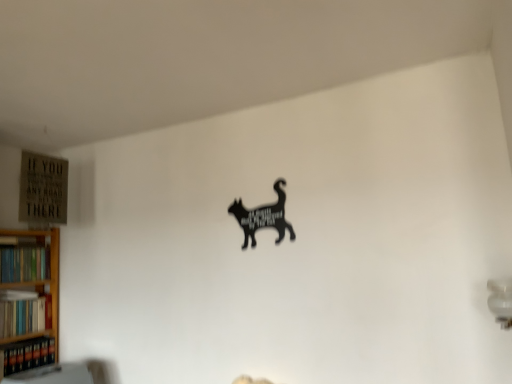
Find the location of a particular element. hardcover books at left, the 2th book when ordered from bottom to top is located at coordinates (24, 313).

In order to face black matte cat at center, should I rotate leftwards or rightwards?

A 0.563 degree turn to the right will do.

Find the location of a particular element. black matte cat at center is located at coordinates (263, 217).

The height and width of the screenshot is (384, 512). What are the coordinates of `hardcover books at left, the second book in the top-to-bottom sequence` in the screenshot? It's located at (24, 313).

Is hardcover books at left, positioned as the third book in bottom-to-top order, behind black matte cat at center?

Yes, hardcover books at left, positioned as the third book in bottom-to-top order, is further from the camera.

Can we say hardcover books at left, positioned as the third book in bottom-to-top order, lies outside black matte cat at center?

Yes.

From the image's perspective, count 1st books downward from the black matte cat at center and point to it. Please provide its 2D coordinates.

[(24, 263)]

From their relative heights in the image, would you say hardcover books at left, the 1th book positioned from the top, is taller or shorter than black matte cat at center?

hardcover books at left, the 1th book positioned from the top, is shorter than black matte cat at center.

Is point (236, 210) positioned in front of point (39, 250)?

Yes, it is in front of point (39, 250).

Is black matte cat at center far away from hardcover books at left, the 1th book positioned from the top?

Yes.

Would you say black matte cat at center is part of hardcover books at lower left, which is the third book in top-to-bottom order,'s contents?

No, black matte cat at center is located outside of hardcover books at lower left, which is the third book in top-to-bottom order.

Which is behind, point (4, 372) or point (284, 208)?

The point (4, 372) is farther.

Looking at their sizes, would you say hardcover books at lower left, the 1th book in the bottom-to-top sequence, is wider or thinner than black matte cat at center?

In the image, hardcover books at lower left, the 1th book in the bottom-to-top sequence, appears to be wider than black matte cat at center.

From a real-world perspective, is hardcover books at lower left, the 1th book in the bottom-to-top sequence, physically above black matte cat at center?

No, from a real-world perspective, hardcover books at lower left, the 1th book in the bottom-to-top sequence, is not on top of black matte cat at center.

Between black matte cat at center and hardcover books at left, the second book in the top-to-bottom sequence, which one has smaller width?

Thinner between the two is black matte cat at center.

Is black matte cat at center looking in the opposite direction of hardcover books at left, the 2th book when ordered from bottom to top?

black matte cat at center does not have its back to hardcover books at left, the 2th book when ordered from bottom to top.

Is black matte cat at center in front of or behind hardcover books at left, the second book in the top-to-bottom sequence, in the image?

black matte cat at center is in front of hardcover books at left, the second book in the top-to-bottom sequence.

Considering the relative positions of black matte cat at center and hardcover books at left, the second book in the top-to-bottom sequence, in the image provided, is black matte cat at center to the left of hardcover books at left, the second book in the top-to-bottom sequence, from the viewer's perspective?

No.

Is hardcover books at left, the 2th book when ordered from bottom to top, taller or shorter than hardcover books at lower left, which is the third book in top-to-bottom order?

Clearly, hardcover books at left, the 2th book when ordered from bottom to top, is taller compared to hardcover books at lower left, which is the third book in top-to-bottom order.

From the image's perspective, is hardcover books at left, the second book in the top-to-bottom sequence, positioned above or below hardcover books at lower left, which is the third book in top-to-bottom order?

From the image's perspective, hardcover books at left, the second book in the top-to-bottom sequence, appears above hardcover books at lower left, which is the third book in top-to-bottom order.

Do you think hardcover books at left, the second book in the top-to-bottom sequence, is within hardcover books at lower left, the 1th book in the bottom-to-top sequence, or outside of it?

hardcover books at left, the second book in the top-to-bottom sequence, is spatially situated outside hardcover books at lower left, the 1th book in the bottom-to-top sequence.

Between point (48, 296) and point (17, 345), which one is positioned behind?

The point (48, 296) is farther.

Which is more to the left, black matte cat at center or hardcover books at lower left, which is the third book in top-to-bottom order?

hardcover books at lower left, which is the third book in top-to-bottom order.

Can you tell me how much black matte cat at center and hardcover books at lower left, which is the third book in top-to-bottom order, differ in facing direction?

92.4 degrees.

From the picture: Considering the relative sizes of black matte cat at center and hardcover books at lower left, which is the third book in top-to-bottom order, in the image provided, is black matte cat at center taller than hardcover books at lower left, which is the third book in top-to-bottom order,?

Indeed, black matte cat at center has a greater height compared to hardcover books at lower left, which is the third book in top-to-bottom order.

Is point (283, 203) positioned in front of point (41, 344)?

Yes.

How much distance is there between hardcover books at lower left, the 1th book in the bottom-to-top sequence, and hardcover books at left, the 1th book positioned from the top?

hardcover books at lower left, the 1th book in the bottom-to-top sequence, and hardcover books at left, the 1th book positioned from the top, are 18.60 inches apart.

From the picture: Is hardcover books at lower left, the 1th book in the bottom-to-top sequence, far from hardcover books at left, positioned as the third book in bottom-to-top order?

Actually, hardcover books at lower left, the 1th book in the bottom-to-top sequence, and hardcover books at left, positioned as the third book in bottom-to-top order, are a little close together.

Relative to hardcover books at left, positioned as the third book in bottom-to-top order, is hardcover books at lower left, which is the third book in top-to-bottom order, in front or behind?

hardcover books at lower left, which is the third book in top-to-bottom order, is positioned closer to the viewer than hardcover books at left, positioned as the third book in bottom-to-top order.

Looking at this image, is hardcover books at lower left, which is the third book in top-to-bottom order, shorter than hardcover books at left, the 1th book positioned from the top?

In fact, hardcover books at lower left, which is the third book in top-to-bottom order, may be taller than hardcover books at left, the 1th book positioned from the top.

At what (x,y) coordinates should I click in order to perform the action: click on animal in front of the hardcover books at left, positioned as the third book in bottom-to-top order. Please return your answer as a coordinate pair (x, y). Looking at the image, I should click on (263, 217).

Find the location of a particular element. animal located above the hardcover books at left, the 1th book positioned from the top (from the image's perspective) is located at coordinates (263, 217).

Considering their positions, is hardcover books at left, positioned as the third book in bottom-to-top order, positioned closer to hardcover books at left, the 2th book when ordered from bottom to top, than hardcover books at lower left, the 1th book in the bottom-to-top sequence?

hardcover books at lower left, the 1th book in the bottom-to-top sequence, is closer to hardcover books at left, the 2th book when ordered from bottom to top.

Estimate the real-world distances between objects in this image. Which object is closer to hardcover books at lower left, which is the third book in top-to-bottom order, black matte cat at center or hardcover books at left, positioned as the third book in bottom-to-top order?

hardcover books at left, positioned as the third book in bottom-to-top order.

When comparing their distances from hardcover books at left, positioned as the third book in bottom-to-top order, does hardcover books at left, the 2th book when ordered from bottom to top, or black matte cat at center seem further?

black matte cat at center is positioned further to the anchor hardcover books at left, positioned as the third book in bottom-to-top order.

Based on their spatial positions, is hardcover books at left, the 2th book when ordered from bottom to top, or hardcover books at left, the 1th book positioned from the top, further from hardcover books at lower left, which is the third book in top-to-bottom order?

hardcover books at left, the 1th book positioned from the top, lies further to hardcover books at lower left, which is the third book in top-to-bottom order, than the other object.

Which object lies further to the anchor point hardcover books at left, positioned as the third book in bottom-to-top order, black matte cat at center or hardcover books at left, the second book in the top-to-bottom sequence?

black matte cat at center.

Estimate the real-world distances between objects in this image. Which object is further from black matte cat at center, hardcover books at left, the 2th book when ordered from bottom to top, or hardcover books at left, positioned as the third book in bottom-to-top order?

hardcover books at left, the 2th book when ordered from bottom to top.

Considering their positions, is hardcover books at lower left, which is the third book in top-to-bottom order, positioned further to hardcover books at left, the 2th book when ordered from bottom to top, than hardcover books at left, positioned as the third book in bottom-to-top order?

Among the two, hardcover books at left, positioned as the third book in bottom-to-top order, is located further to hardcover books at left, the 2th book when ordered from bottom to top.

Consider the image. Based on their spatial positions, is hardcover books at left, the 2th book when ordered from bottom to top, or black matte cat at center further from hardcover books at lower left, which is the third book in top-to-bottom order?

The object further to hardcover books at lower left, which is the third book in top-to-bottom order, is black matte cat at center.

You are a GUI agent. You are given a task and a screenshot of the screen. Output one action in this format:
    pyautogui.click(x=<x>, y=<y>)
    Task: Click on the book situated between hardcover books at left, the 2th book when ordered from bottom to top, and black matte cat at center from left to right
    Image resolution: width=512 pixels, height=384 pixels.
    Given the screenshot: What is the action you would take?
    pyautogui.click(x=28, y=354)

Identify the location of book between hardcover books at left, the 1th book positioned from the top, and hardcover books at lower left, which is the third book in top-to-bottom order, vertically. This screenshot has height=384, width=512. (24, 313).